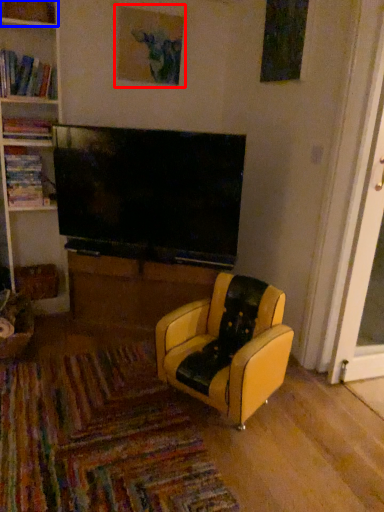
Question: Which object is further to the camera taking this photo, picture frame (highlighted by a red box) or shelf (highlighted by a blue box)?

Choices:
 (A) picture frame
 (B) shelf

Answer: (A)